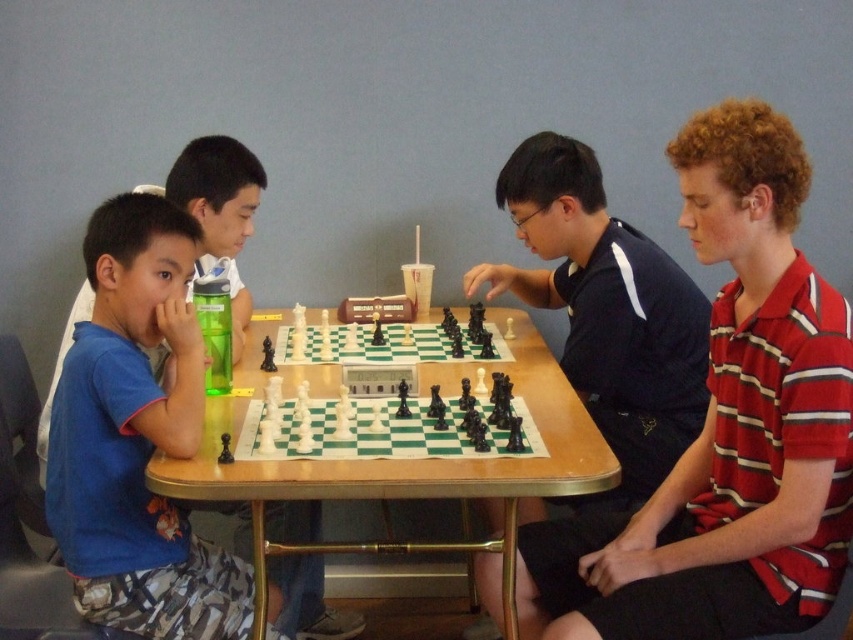
You are a photographer trying to capture the chess piece and the shirt in the same frame. Since the striped cotton shirt at right is under the black glossy chess piece at center, will you need to adjust your camera angle to include both?

Yes, you need to adjust your camera angle because the striped cotton shirt at right is positioned under the black glossy chess piece at center, so tilting the camera slightly downward or moving it to the side might help capture both in the frame.

In the scene shown: You are standing in front of the chess table and want to place a new chess piece. You have two points to choose from on the table surface. The first point is at coordinates point (809, 536) and the second is at point (657, 332). Which point is closer to you?

Point (809, 536) is closer to the viewer than point (657, 332), so you should choose that point to place the new chess piece.